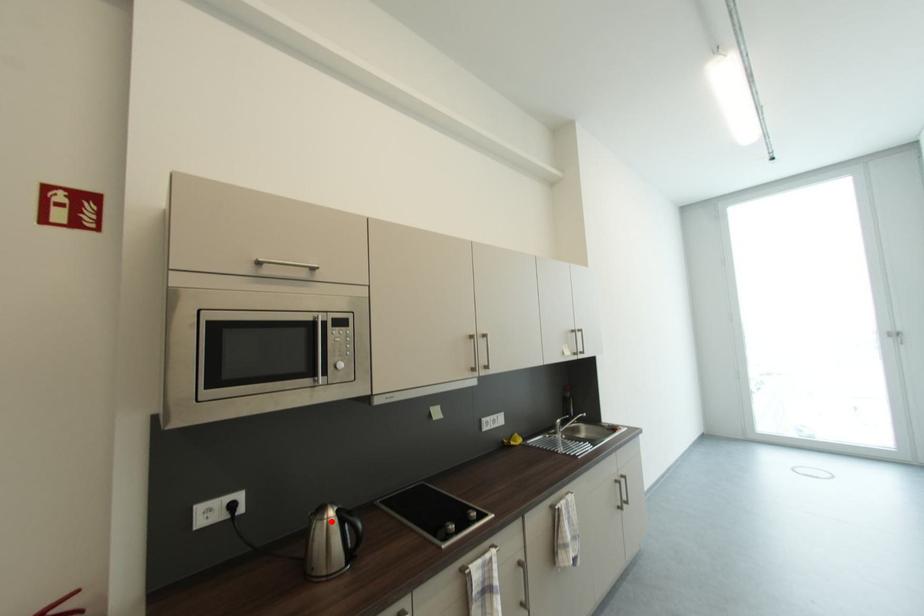
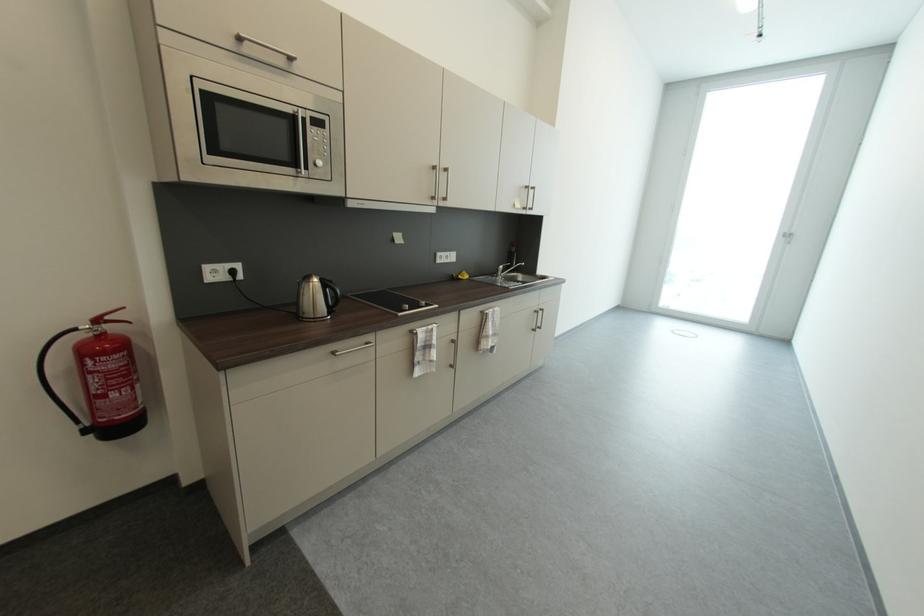
In the second image, find the point that corresponds to the highlighted location in the first image.

(317, 285)